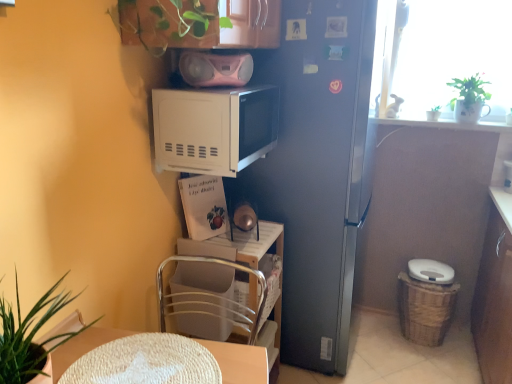
Find the location of a particular element. white plastic chair at lower center is located at coordinates (211, 298).

Image resolution: width=512 pixels, height=384 pixels. What do you see at coordinates (469, 98) in the screenshot?
I see `green matte plant at upper right, which is the 1th houseplant in right-to-left order` at bounding box center [469, 98].

In order to face white woven placemat at lower center, should I rotate leftwards or rightwards?

To align with it, rotate left about 14.850°.

Where is `woven brown basket at lower right`? This screenshot has width=512, height=384. woven brown basket at lower right is located at coordinates (425, 309).

From a real-world perspective, is white matte microwave at upper center physically located above or below woven brown basket at lower right?

From a real-world perspective, white matte microwave at upper center is physically above woven brown basket at lower right.

Does white matte microwave at upper center come in front of woven brown basket at lower right?

Yes, white matte microwave at upper center is in front of woven brown basket at lower right.

Which is more to the right, white matte microwave at upper center or woven brown basket at lower right?

woven brown basket at lower right.

Which point is more distant from viewer, (164, 155) or (449, 312)?

The point (449, 312) is farther from the camera.

Could you tell me if woven brown basket at lower right is turned towards white plastic chair at lower center?

No.

Is woven brown basket at lower right positioned beyond the bounds of white plastic chair at lower center?

That's correct, woven brown basket at lower right is outside of white plastic chair at lower center.

Is the surface of woven brown basket at lower right in direct contact with white plastic chair at lower center?

There is a gap between woven brown basket at lower right and white plastic chair at lower center.

Which object is positioned more to the right, woven brown basket at lower right or white plastic chair at lower center?

woven brown basket at lower right.

The height and width of the screenshot is (384, 512). I want to click on fridge on the right of white woven placemat at lower center, so tap(317, 169).

Between point (303, 169) and point (61, 366), which one is positioned in front?

The point (61, 366) is more forward.

What's the angular difference between satin silver refrigerator at center and white woven placemat at lower center's facing directions?

0.102 degrees.

Is satin silver refrigerator at center closer to the viewer compared to white woven placemat at lower center?

No, it is not.

From the image's perspective, which one is positioned lower, white plastic chair at lower center or satin silver refrigerator at center?

white plastic chair at lower center is shown below in the image.

Visually, is white plastic chair at lower center positioned to the left or to the right of satin silver refrigerator at center?

Based on their positions, white plastic chair at lower center is located to the left of satin silver refrigerator at center.

Considering the relative sizes of white plastic chair at lower center and satin silver refrigerator at center in the image provided, is white plastic chair at lower center wider than satin silver refrigerator at center?

No.

Is white woven placemat at lower center aimed at white plastic chair at lower center?

No, white woven placemat at lower center does not turn towards white plastic chair at lower center.

Considering the positions of points (72, 352) and (244, 324), is point (72, 352) closer to camera compared to point (244, 324)?

Yes, point (72, 352) is in front of point (244, 324).

Is white woven placemat at lower center positioned beyond the bounds of white plastic chair at lower center?

Yes, white woven placemat at lower center is not within white plastic chair at lower center.

Would you say white woven placemat at lower center is a long distance from white plastic chair at lower center?

That's not correct — white woven placemat at lower center is a little close to white plastic chair at lower center.

From the image's perspective, is pink plastic boombox at upper center beneath white plastic chair at lower center?

No.

From a real-world perspective, is pink plastic boombox at upper center located higher than white plastic chair at lower center?

Yes.

Can you confirm if pink plastic boombox at upper center is wider than white plastic chair at lower center?

Yes.

From the image's perspective, which object appears higher, white woven placemat at lower center or pink plastic boombox at upper center?

pink plastic boombox at upper center is shown above in the image.

Who is bigger, white woven placemat at lower center or pink plastic boombox at upper center?

pink plastic boombox at upper center is bigger.

Is white woven placemat at lower center wider or thinner than pink plastic boombox at upper center?

Considering their sizes, white woven placemat at lower center looks broader than pink plastic boombox at upper center.

Is white woven placemat at lower center positioned before pink plastic boombox at upper center?

Yes, white woven placemat at lower center is in front of pink plastic boombox at upper center.

Find the location of a particular element. This screenshot has height=384, width=512. microwave oven located on the left of woven brown basket at lower right is located at coordinates (214, 128).

Where is `chair in front of the woven brown basket at lower right`? chair in front of the woven brown basket at lower right is located at coordinates (211, 298).

Looking at the image, which one is located further to satin silver refrigerator at center, green leafy plant at lower left, which appears as the 1th houseplant when viewed from the front, or pink plastic boombox at upper center?

green leafy plant at lower left, which appears as the 1th houseplant when viewed from the front, lies further to satin silver refrigerator at center than the other object.

Looking at this image, when comparing their distances from white glossy pot at upper right, acting as the second houseplant starting from the left, does green leafy plant at lower left, the 3th houseplant positioned from the right, or white matte microwave at upper center seem further?

green leafy plant at lower left, the 3th houseplant positioned from the right, is further to white glossy pot at upper right, acting as the second houseplant starting from the left.

Which object lies nearer to the anchor point pink plastic boombox at upper center, white plastic chair at lower center or green leafy plant at lower left, the 3th houseplant positioned from the right?

white plastic chair at lower center.

Considering their positions, is white plastic chair at lower center positioned further to white glossy pot at upper right, the 1th houseplant positioned from the back, than white matte microwave at upper center?

white plastic chair at lower center is positioned further to the anchor white glossy pot at upper right, the 1th houseplant positioned from the back.

Based on the photo, estimate the real-world distances between objects in this image. Which object is closer to green matte plant at upper right, arranged as the second houseplant when viewed from the back, white woven placemat at lower center or satin silver refrigerator at center?

satin silver refrigerator at center is positioned closer to the anchor green matte plant at upper right, arranged as the second houseplant when viewed from the back.

Considering their positions, is white matte microwave at upper center positioned closer to white woven placemat at lower center than white plastic chair at lower center?

white plastic chair at lower center.

Considering their positions, is satin silver refrigerator at center positioned further to green matte plant at upper right, arranged as the second houseplant when viewed from the back, than pink plastic boombox at upper center?

pink plastic boombox at upper center lies further to green matte plant at upper right, arranged as the second houseplant when viewed from the back, than the other object.

Which object lies nearer to the anchor point pink plastic boombox at upper center, white woven placemat at lower center or woven brown basket at lower right?

Based on the image, white woven placemat at lower center appears to be nearer to pink plastic boombox at upper center.

At what (x,y) coordinates should I click in order to perform the action: click on microwave oven located between green leafy plant at lower left, which appears as the 1th houseplant when viewed from the front, and white glossy pot at upper right, the 1th houseplant positioned from the back, in the depth direction. Please return your answer as a coordinate pair (x, y). The height and width of the screenshot is (384, 512). Looking at the image, I should click on (214, 128).

This screenshot has width=512, height=384. I want to click on chair located between green leafy plant at lower left, the 3th houseplant positioned from the right, and green matte plant at upper right, positioned as the second houseplant in front-to-back order, in the left-right direction, so click(x=211, y=298).

The image size is (512, 384). What are the coordinates of `fridge located between white plastic chair at lower center and white glossy pot at upper right, acting as the second houseplant starting from the left, in the left-right direction` in the screenshot? It's located at tap(317, 169).

Where is `microwave oven positioned between white woven placemat at lower center and satin silver refrigerator at center from near to far`? microwave oven positioned between white woven placemat at lower center and satin silver refrigerator at center from near to far is located at coordinates (214, 128).